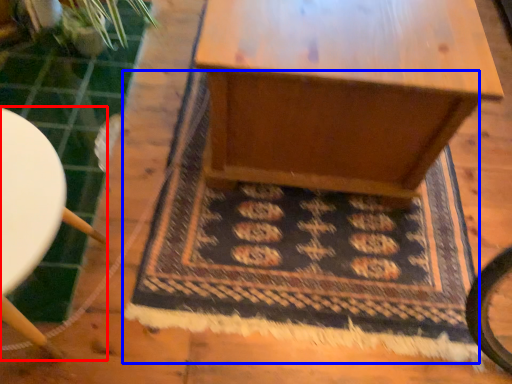
Question: Which object appears farthest to the camera in this image, furniture (highlighted by a red box) or mat (highlighted by a blue box)?

Choices:
 (A) furniture
 (B) mat

Answer: (B)